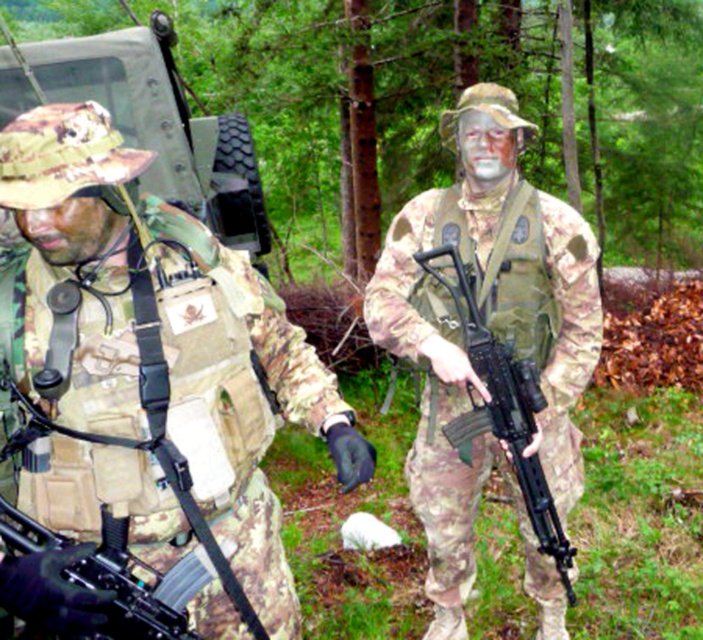
Who is higher up, camouflage fabric uniform at center or camo fabric uniform at center?

camouflage fabric uniform at center

Can you confirm if camouflage fabric uniform at center is taller than camo fabric uniform at center?

Incorrect, camouflage fabric uniform at center's height is not larger of camo fabric uniform at center's.

Describe the element at coordinates (143, 392) in the screenshot. The image size is (703, 640). I see `camouflage fabric uniform at center` at that location.

Where is `camouflage fabric uniform at center`? Image resolution: width=703 pixels, height=640 pixels. camouflage fabric uniform at center is located at coordinates (143, 392).